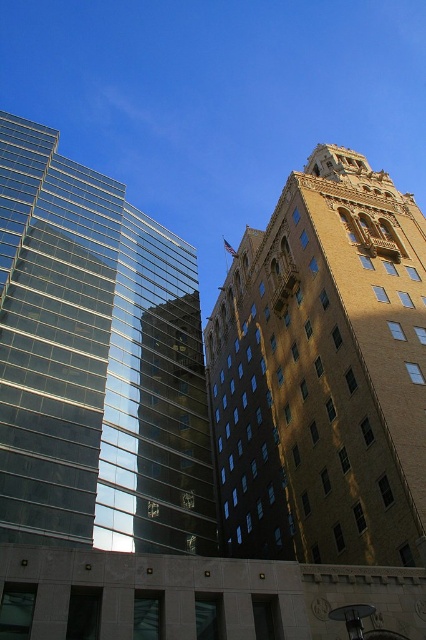
Question: Observing the image, what is the correct spatial positioning of golden stone tower at upper right in reference to transparent glass building at left?

Choices:
 (A) left
 (B) right

Answer: (B)

Question: Where is golden stone tower at upper right located in relation to transparent glass building at left in the image?

Choices:
 (A) below
 (B) above

Answer: (A)

Question: Which point appears closest to the camera in this image?

Choices:
 (A) (199, 451)
 (B) (377, 417)

Answer: (B)

Question: Can you confirm if golden stone tower at upper right is smaller than transparent glass building at left?

Choices:
 (A) yes
 (B) no

Answer: (B)